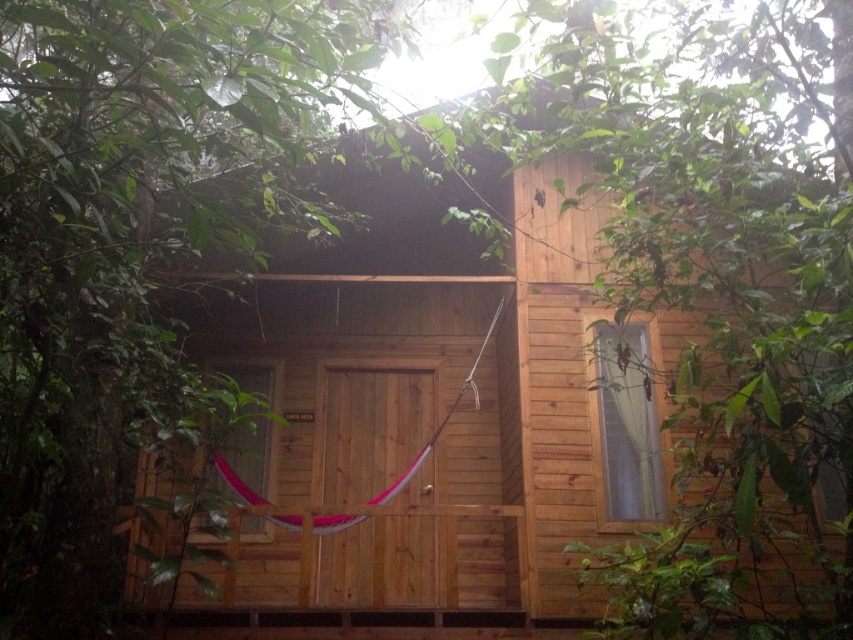
You are planning to build a new cabin in the forest. You see the natural wood cabin at center and the green wood tree at center in the image. Which structure takes up more area in the scene?

The green wood tree at center occupies more space than the natural wood cabin at center.